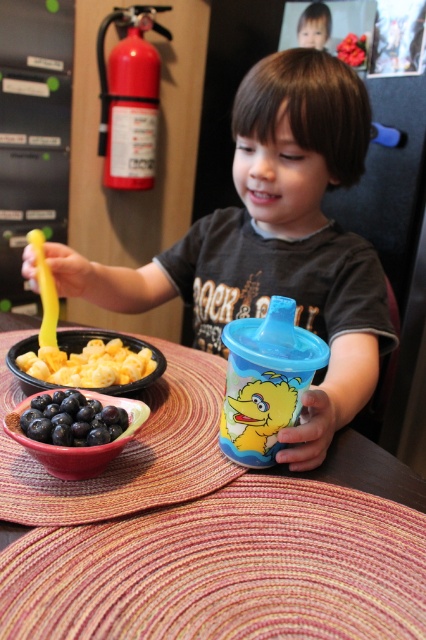
Based on the photo, can you confirm if wooden placemat at center is smaller than matte pink bowl at lower left?

No, wooden placemat at center is not smaller than matte pink bowl at lower left.

Can you confirm if wooden placemat at center is bigger than matte pink bowl at lower left?

Indeed, wooden placemat at center has a larger size compared to matte pink bowl at lower left.

Is point (6, 566) positioned after point (104, 403)?

No, (6, 566) is closer to viewer.

Locate an element on the screen. wooden placemat at center is located at coordinates (210, 532).

Does matte plastic cup at center appear under yellow rubbery spoon at left?

No.

Between matte plastic cup at center and yellow rubbery spoon at left, which one is positioned higher?

matte plastic cup at center is above.

Between point (268, 92) and point (60, 362), which one is positioned in front?

Positioned in front is point (60, 362).

Where is `matte plastic cup at center`? The image size is (426, 640). matte plastic cup at center is located at coordinates (275, 241).

Is matte plastic cup at center to the right of blue matte/blueberry at lower left from the viewer's perspective?

Correct, you'll find matte plastic cup at center to the right of blue matte/blueberry at lower left.

Measure the distance between matte plastic cup at center and blue matte/blueberry at lower left.

matte plastic cup at center is 39.56 centimeters away from blue matte/blueberry at lower left.

Identify the location of matte plastic cup at center. (275, 241).